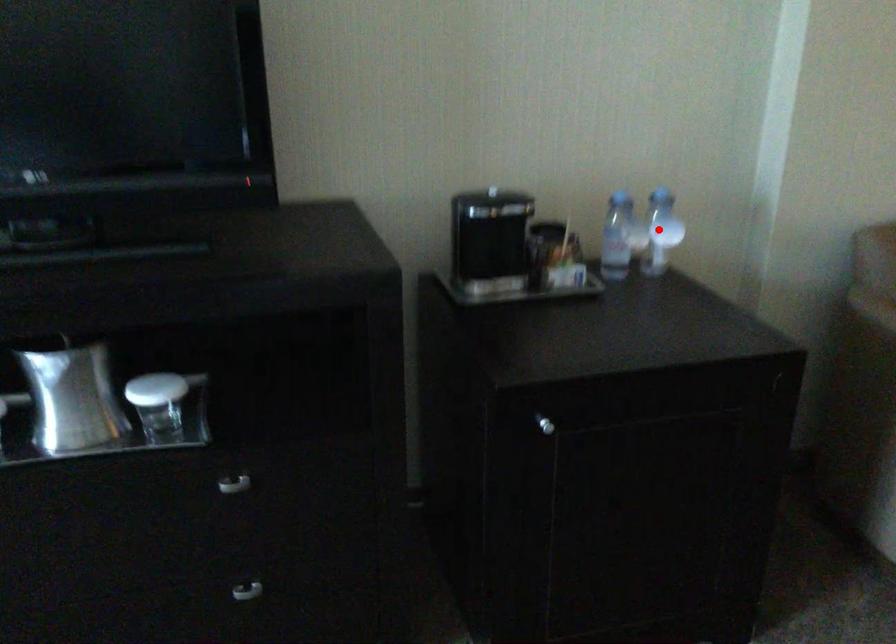
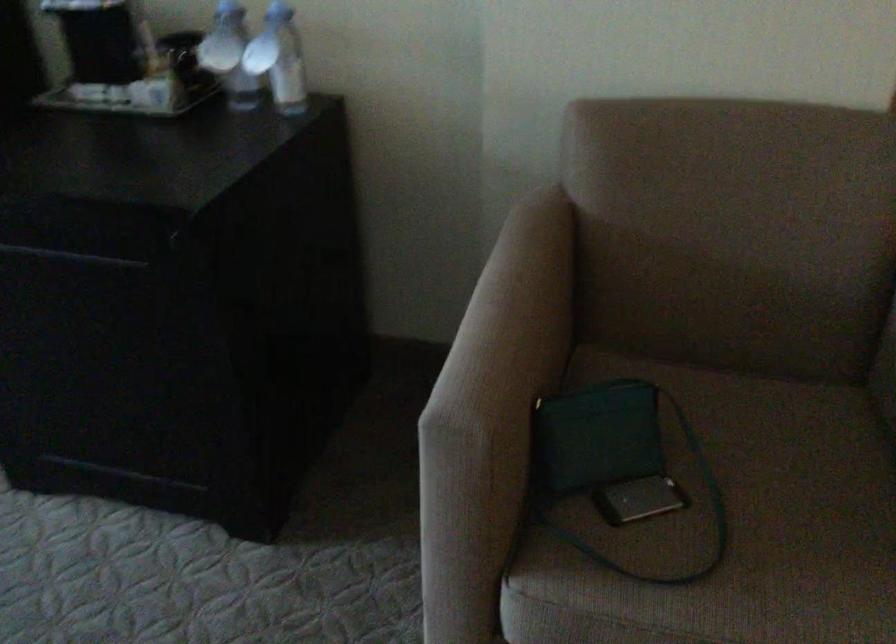
Locate, in the second image, the point that corresponds to the highlighted location in the first image.

(279, 59)